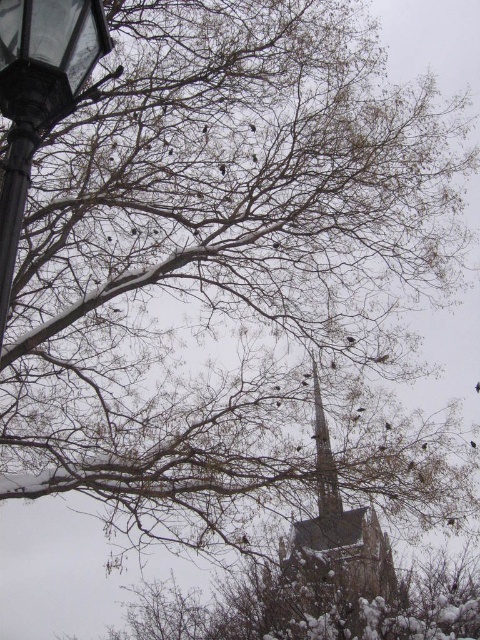
Consider the image. You are standing at the center of the winter scene and want to locate the black metal street light at upper left. Which direction should you face to see it?

The black metal street light at upper left is located at point 0.150 on the x axis and 0.083 on the y axis, so you should face the upper left direction to see it.